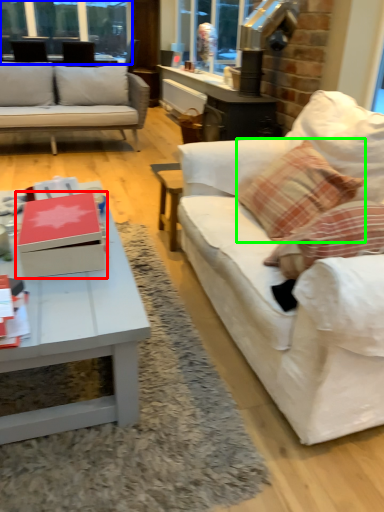
Question: Considering the real-world distances, which object is farthest from box (highlighted by a red box)? window frame (highlighted by a blue box) or throw pillow (highlighted by a green box)?

Choices:
 (A) window frame
 (B) throw pillow

Answer: (A)